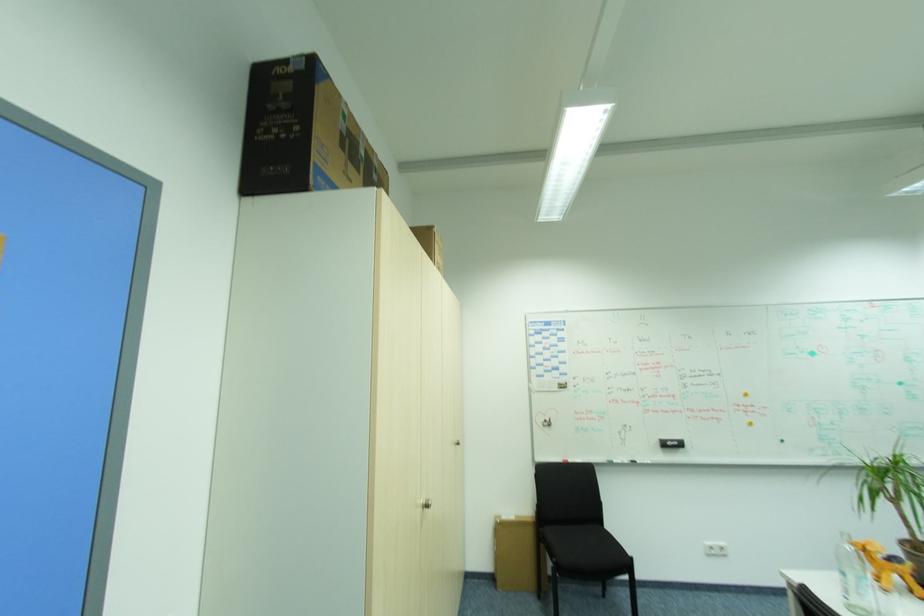
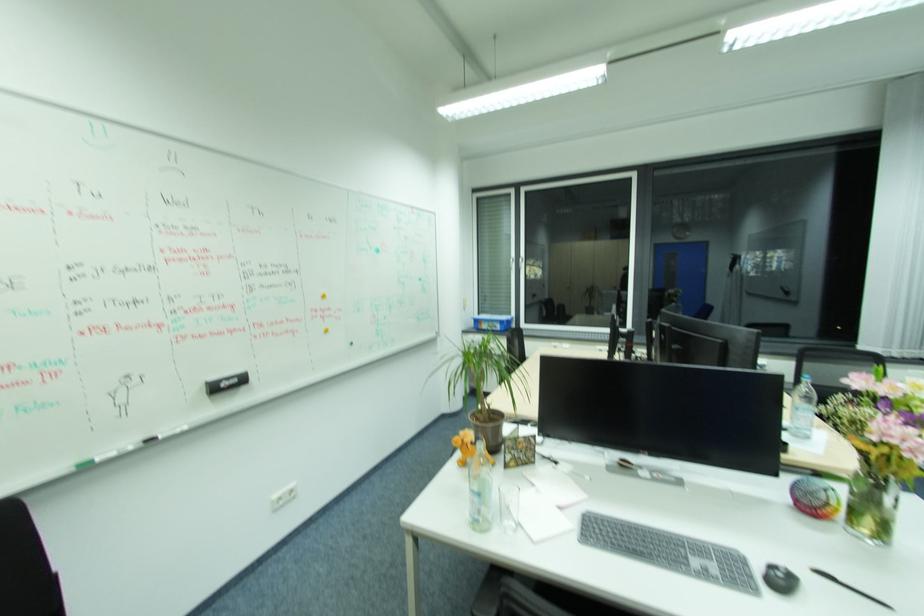
In the second image, find the point that corresponds to (621,462) in the first image.

(105, 460)